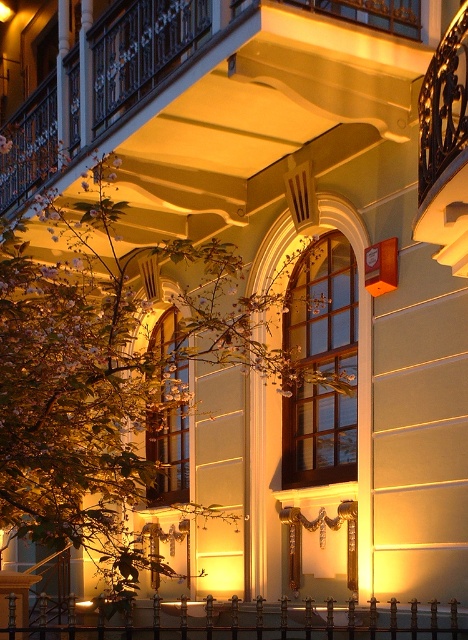
Question: Which of these objects is positioned closest to the wooden window at center?

Choices:
 (A) green leafy tree at center
 (B) black wrought iron railing at lower center

Answer: (A)

Question: Does matte glass window at center appear over black wrought iron railing at lower center?

Choices:
 (A) yes
 (B) no

Answer: (A)

Question: Is green leafy tree at center above black wrought iron railing at lower center?

Choices:
 (A) no
 (B) yes

Answer: (B)

Question: Which point is farther to the camera?

Choices:
 (A) (51, 225)
 (B) (300, 385)

Answer: (A)

Question: Is the position of green leafy tree at center less distant than that of black wrought iron railing at lower center?

Choices:
 (A) no
 (B) yes

Answer: (B)

Question: Which of the following is the farthest from the observer?

Choices:
 (A) (181, 333)
 (B) (307, 465)

Answer: (A)